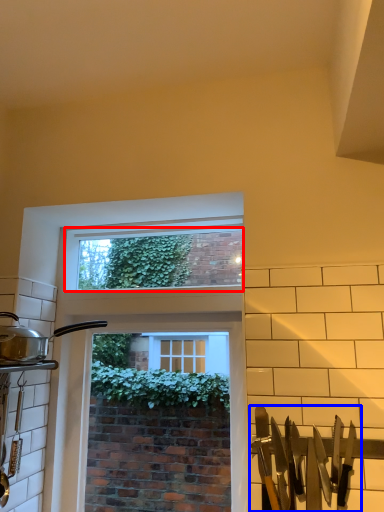
Question: Among these objects, which one is farthest to the camera, window screen (highlighted by a red box) or silverware (highlighted by a blue box)?

Choices:
 (A) window screen
 (B) silverware

Answer: (A)